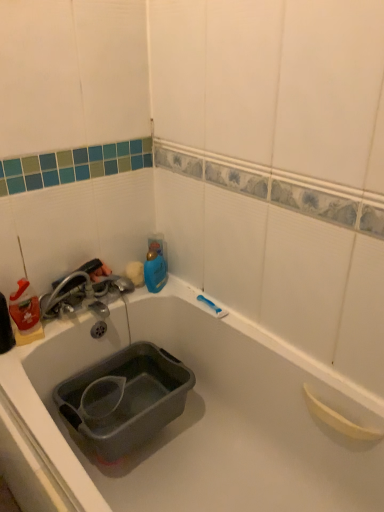
Image resolution: width=384 pixels, height=512 pixels. Identify the location of translucent plastic bottle at left. (25, 308).

In order to face metallic silver faucet at left, should I rotate leftwards or rightwards?

To align with it, rotate left about 14.399°.

The width and height of the screenshot is (384, 512). Find the location of `blue plastic bottle at upper center`. blue plastic bottle at upper center is located at coordinates (155, 269).

Is blue plastic bottle at upper center turned away from metallic silver faucet at left?

No, blue plastic bottle at upper center is not facing away from metallic silver faucet at left.

Which is more to the right, blue plastic bottle at upper center or metallic silver faucet at left?

Positioned to the right is blue plastic bottle at upper center.

Is blue plastic bottle at upper center spatially inside metallic silver faucet at left, or outside of it?

blue plastic bottle at upper center is not enclosed by metallic silver faucet at left.

Is blue plastic bottle at upper center smaller than metallic silver faucet at left?

Indeed, blue plastic bottle at upper center has a smaller size compared to metallic silver faucet at left.

Looking at this image, what's the angular difference between metallic silver faucet at left and blue plastic bottle at upper center's facing directions?

The angular difference between metallic silver faucet at left and blue plastic bottle at upper center is 0.00202 degrees.

Are metallic silver faucet at left and blue plastic bottle at upper center located far from each other?

metallic silver faucet at left is near blue plastic bottle at upper center, not far away.

Considering the sizes of objects metallic silver faucet at left and blue plastic bottle at upper center in the image provided, who is wider, metallic silver faucet at left or blue plastic bottle at upper center?

Wider between the two is metallic silver faucet at left.

Locate an element on the screen. The image size is (384, 512). tap positioned vertically above the blue plastic bottle at upper center (from a real-world perspective) is located at coordinates coord(65,285).

In terms of width, does translucent plastic bottle at left look wider or thinner when compared to metallic silver faucet at left?

In the image, translucent plastic bottle at left appears to be more narrow than metallic silver faucet at left.

Locate an element on the screen. The width and height of the screenshot is (384, 512). cleaning product in front of the metallic silver faucet at left is located at coordinates (25, 308).

Between translucent plastic bottle at left and metallic silver faucet at left, which one has less height?

With less height is metallic silver faucet at left.

The width and height of the screenshot is (384, 512). Identify the location of bottle behind the translucent plastic bottle at left. (155, 269).

Measure the distance from blue plastic bottle at upper center to translucent plastic bottle at left.

44.54 centimeters.

Considering the relative sizes of blue plastic bottle at upper center and translucent plastic bottle at left in the image provided, is blue plastic bottle at upper center smaller than translucent plastic bottle at left?

Yes.

Which object is closer to the camera taking this photo, blue plastic bottle at upper center or translucent plastic bottle at left?

translucent plastic bottle at left is in front.

Considering the points (92, 295) and (26, 296), which point is in front, point (92, 295) or point (26, 296)?

Point (26, 296)

Is metallic silver faucet at left oriented towards translucent plastic bottle at left?

No, metallic silver faucet at left is not aimed at translucent plastic bottle at left.

Would you say metallic silver faucet at left is a long distance from translucent plastic bottle at left?

No, metallic silver faucet at left is not far from translucent plastic bottle at left.

Is metallic silver faucet at left further to camera compared to translucent plastic bottle at left?

Yes, metallic silver faucet at left is further from the camera.

Is translucent plastic bottle at left in front of or behind blue plastic bottle at upper center in the image?

Visually, translucent plastic bottle at left is located in front of blue plastic bottle at upper center.

Does translucent plastic bottle at left have a lesser height compared to blue plastic bottle at upper center?

In fact, translucent plastic bottle at left may be taller than blue plastic bottle at upper center.

Is translucent plastic bottle at left inside the boundaries of blue plastic bottle at upper center, or outside?

translucent plastic bottle at left is located beyond the bounds of blue plastic bottle at upper center.

Who is smaller, translucent plastic bottle at left or blue plastic bottle at upper center?

Smaller between the two is blue plastic bottle at upper center.

The image size is (384, 512). I want to click on tap in front of the blue plastic bottle at upper center, so click(x=65, y=285).

This screenshot has height=512, width=384. I want to click on tap below the blue plastic bottle at upper center (from the image's perspective), so click(65, 285).

Based on their spatial positions, is blue plastic bottle at upper center or metallic silver faucet at left further from translucent plastic bottle at left?

blue plastic bottle at upper center.

Looking at this image, from the image, which object appears to be nearer to blue plastic bottle at upper center, translucent plastic bottle at left or metallic silver faucet at left?

Based on the image, metallic silver faucet at left appears to be nearer to blue plastic bottle at upper center.

Based on their spatial positions, is translucent plastic bottle at left or blue plastic bottle at upper center closer to metallic silver faucet at left?

translucent plastic bottle at left is positioned closer to the anchor metallic silver faucet at left.

When comparing their distances from translucent plastic bottle at left, does metallic silver faucet at left or blue plastic bottle at upper center seem further?

blue plastic bottle at upper center is further to translucent plastic bottle at left.

Based on their spatial positions, is metallic silver faucet at left or translucent plastic bottle at left closer to blue plastic bottle at upper center?

metallic silver faucet at left.

Based on their spatial positions, is blue plastic bottle at upper center or translucent plastic bottle at left closer to metallic silver faucet at left?

Based on the image, translucent plastic bottle at left appears to be nearer to metallic silver faucet at left.

The width and height of the screenshot is (384, 512). Find the location of `tap between translucent plastic bottle at left and blue plastic bottle at upper center in the horizontal direction`. tap between translucent plastic bottle at left and blue plastic bottle at upper center in the horizontal direction is located at coordinates (65, 285).